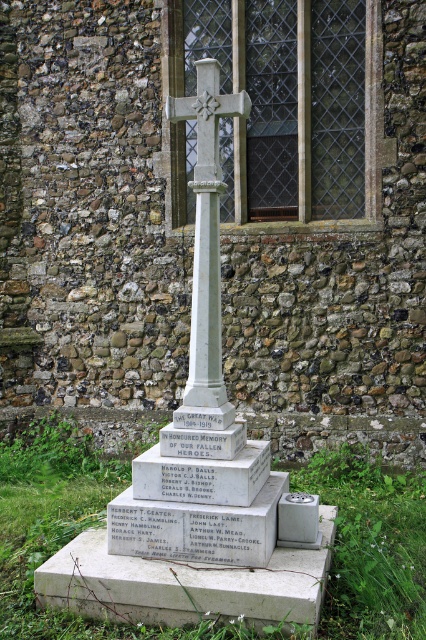
Is gray stone cross at center smaller than white stone cross at center?

Actually, gray stone cross at center might be larger than white stone cross at center.

Does point (112, 532) come behind point (213, 67)?

No, it is in front of (213, 67).

Is point (169, 448) positioned behind point (201, 385)?

That is False.

Locate an element on the screen. gray stone cross at center is located at coordinates (199, 474).